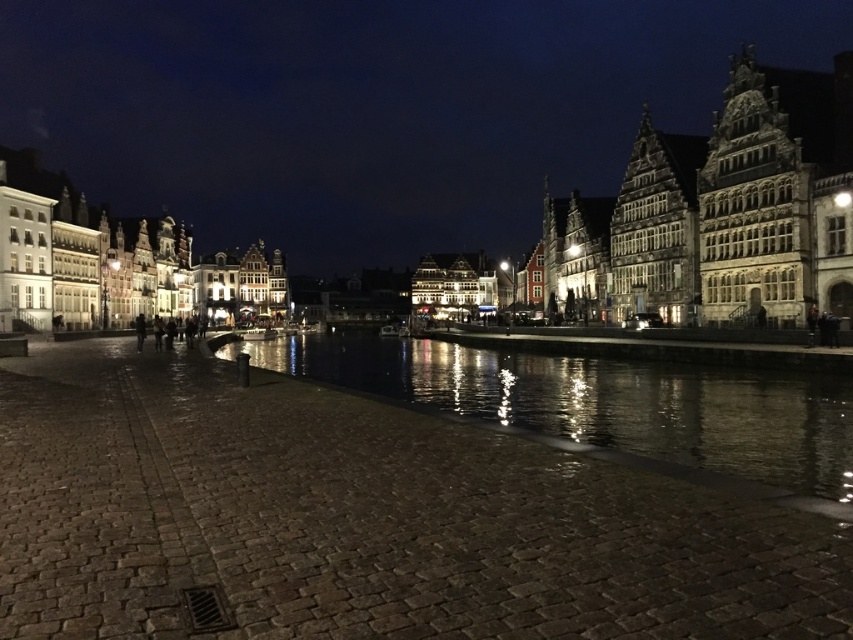
You are standing at the point indicated by point (372,108) in the image. What can you see directly in front of you?

You can see stone buildings at center directly in front of you at point (372,108).

You are standing on the cobblestone riverside promenade and want to take a photo of the stone buildings at center and the reflective dark water at center. Which object should you focus on first if you want to capture both in a single frame without moving the camera?

You should focus on the stone buildings at center first because they are located above the reflective dark water at center, so adjusting the camera to capture the upper part ensures both elements are included in the frame.

You are an architect analyzing the layout of the riverside promenade. Based on the scene, which object occupies a larger horizontal space in the image? Please compare the stone buildings at center and the reflective dark water at center.

The stone buildings at center occupy a larger horizontal space in the image than the reflective dark water at center, as their width surpasses that of the reflective dark water at center according to the description.